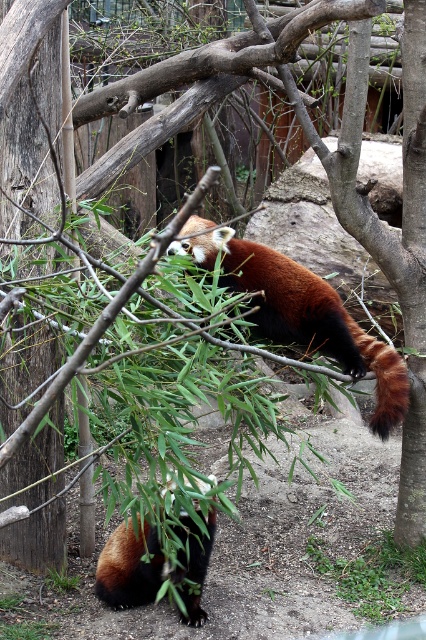
You are a zookeeper observing the red pandas in their enclosure. You notice a point marked at coordinates (301, 310). What animal is located at that point?

The point at coordinates (301, 310) corresponds to the fluffy reddish brown red panda at center.